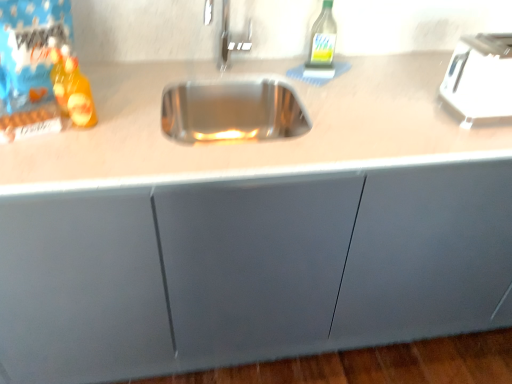
At what (x,y) coordinates should I click in order to perform the action: click on free space to the back side of translucent plastic bottle at left, the 2th bottle from the right. Please return your answer as a coordinate pair (x, y). The image size is (512, 384). Looking at the image, I should click on (119, 94).